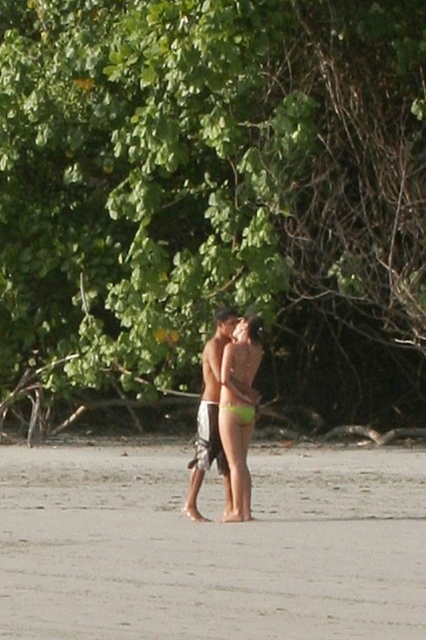
Question: Which of the following is the closest to the observer?

Choices:
 (A) green leafy tree at upper center
 (B) green matte bikini bottom at center

Answer: (B)

Question: Is green matte bikini bottom at center above green fabric bikini at center?

Choices:
 (A) yes
 (B) no

Answer: (B)

Question: Which object is the farthest from the green matte bikini bottom at center?

Choices:
 (A) gray sand at center
 (B) green fabric bikini at center
 (C) green leafy tree at upper center
 (D) light brown textured shorts at center

Answer: (C)

Question: Which point is closer to the camera?

Choices:
 (A) gray sand at center
 (B) green fabric bikini at center
 (C) green matte bikini bottom at center
 (D) light brown textured shorts at center

Answer: (A)

Question: Observing the image, what is the correct spatial positioning of gray sand at center in reference to light brown textured shorts at center?

Choices:
 (A) left
 (B) right

Answer: (A)

Question: Is gray sand at center smaller than light brown textured shorts at center?

Choices:
 (A) yes
 (B) no

Answer: (B)